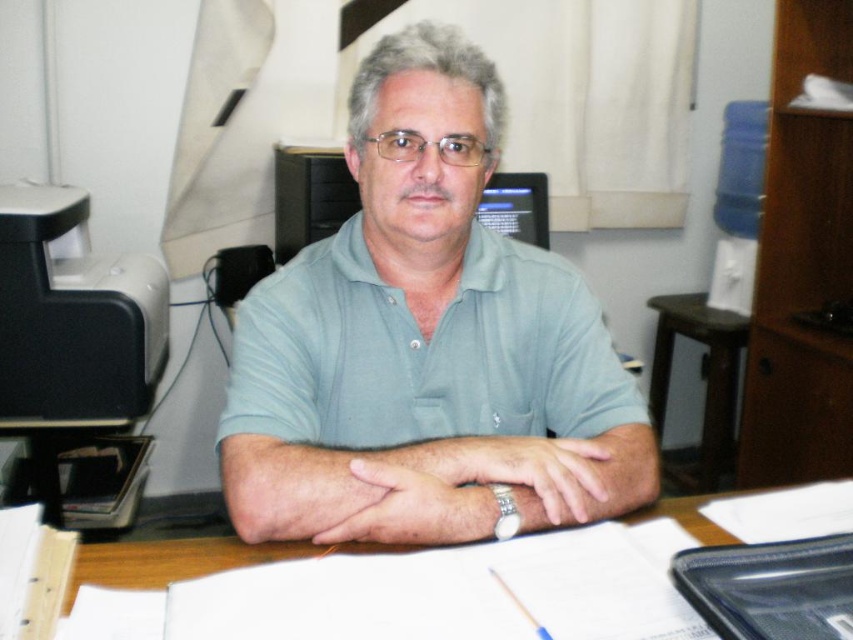
Question: Which is nearer to the light blue cotton shirt at center?

Choices:
 (A) wooden table at right
 (B) wooden table at center

Answer: (B)

Question: Which point is farther to the camera?

Choices:
 (A) (322, 580)
 (B) (659, 388)

Answer: (B)

Question: From the image, what is the correct spatial relationship of light blue cotton shirt at center in relation to wooden table at right?

Choices:
 (A) left
 (B) right

Answer: (A)

Question: Can you confirm if wooden table at center is positioned to the left of wooden table at right?

Choices:
 (A) no
 (B) yes

Answer: (B)

Question: Does wooden table at center have a larger size compared to wooden table at right?

Choices:
 (A) no
 (B) yes

Answer: (A)

Question: Which is farther from the wooden table at right?

Choices:
 (A) wooden table at center
 (B) light blue cotton shirt at center

Answer: (A)